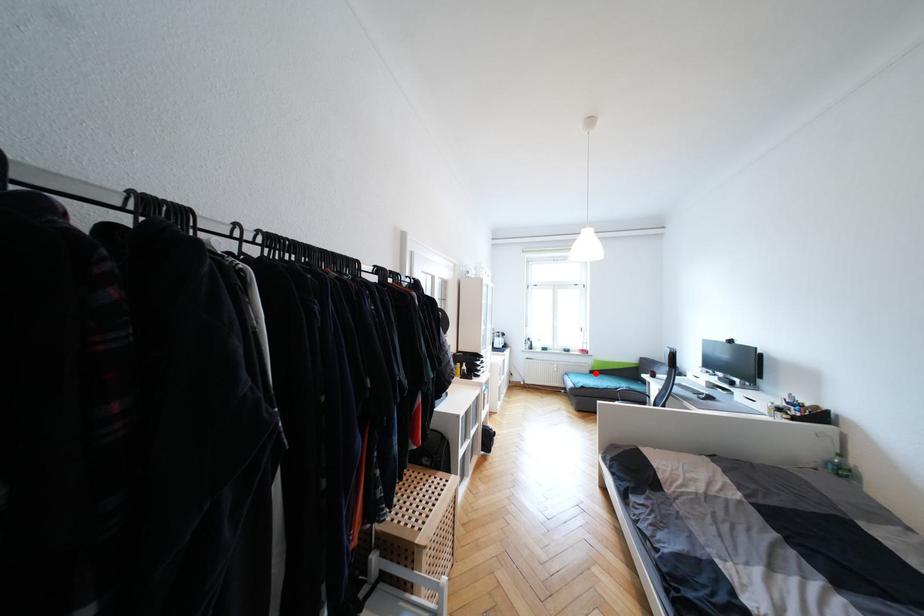
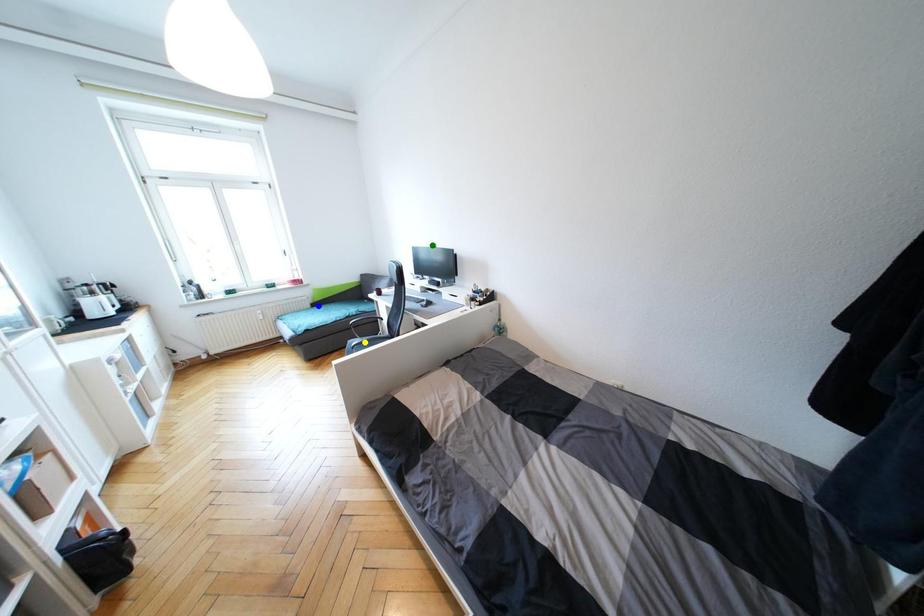
Question: I am providing you with two images of the same scene from different viewpoints. A red point is marked on the first image. You are given multiple points on the second image. Can you choose the point in image 2 that corresponds to the point in image 1?

Choices:
 (A) blue point
 (B) yellow point
 (C) green point

Answer: (A)